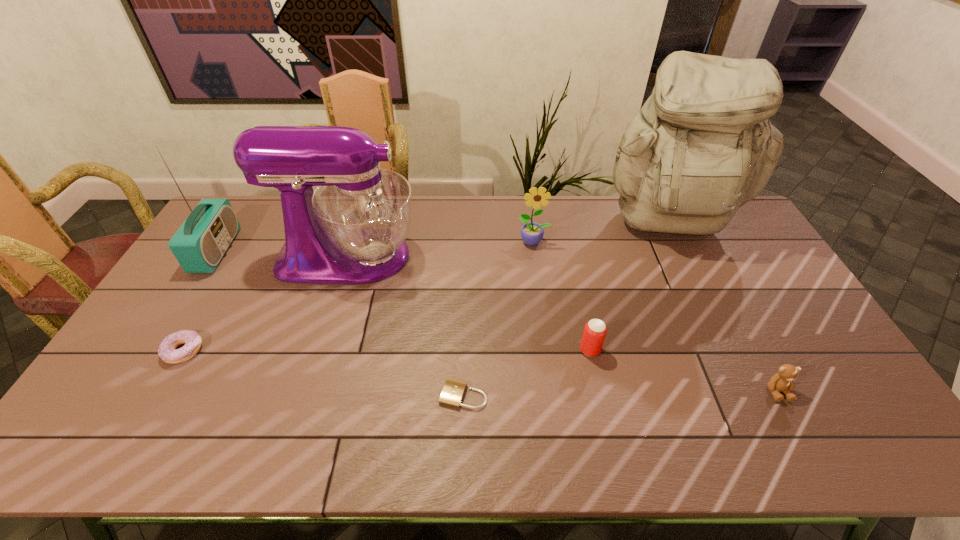
Locate an element on the screen. the tallest object is located at coordinates (702, 146).

Where is `the seventh shortest object`? This screenshot has height=540, width=960. the seventh shortest object is located at coordinates (351, 229).

Where is `the third object from left to right`? the third object from left to right is located at coordinates (351, 229).

The height and width of the screenshot is (540, 960). What are the coordinates of `the sixth shortest object` in the screenshot? It's located at (200, 243).

Identify the location of sunflower. This screenshot has height=540, width=960. (532, 233).

Where is `the fourth object from right to left`? the fourth object from right to left is located at coordinates (532, 233).

The image size is (960, 540). Find the location of `the third object from right to left`. the third object from right to left is located at coordinates (595, 330).

You are a GUI agent. You are given a task and a screenshot of the screen. Output one action in this format:
    pyautogui.click(x=<x>, y=<y>)
    Task: Click on the fourth shortest object
    This screenshot has width=960, height=540.
    Given the screenshot: What is the action you would take?
    pyautogui.click(x=595, y=330)

Identify the location of teddy bear. The image size is (960, 540). (783, 381).

You are a GUI agent. You are given a task and a screenshot of the screen. Output one action in this format:
    pyautogui.click(x=<x>, y=<y>)
    Task: Click on the doughnut
    Image resolution: width=960 pixels, height=540 pixels.
    Given the screenshot: What is the action you would take?
    pyautogui.click(x=167, y=350)